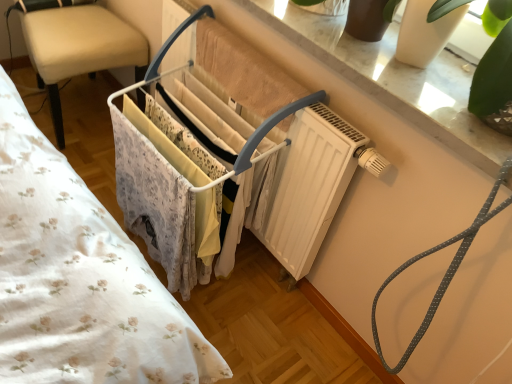
Find the location of `free point above white marble window sill at upper center (from a real-world perspective)`. free point above white marble window sill at upper center (from a real-world perspective) is located at coordinates (397, 63).